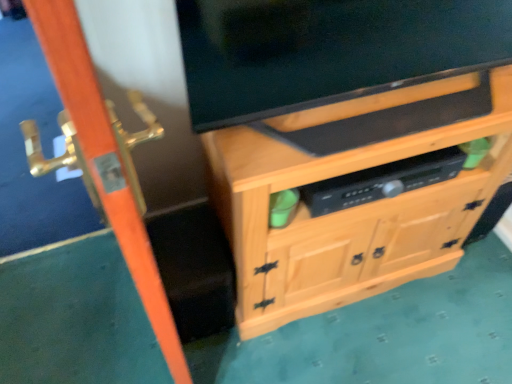
Question: From the image's perspective, is black plastic speaker at center located above matte black tv at upper center?

Choices:
 (A) yes
 (B) no

Answer: (B)

Question: From a real-world perspective, is black plastic speaker at center under matte black tv at upper center?

Choices:
 (A) yes
 (B) no

Answer: (A)

Question: Can we say black plastic speaker at center lies outside matte black tv at upper center?

Choices:
 (A) no
 (B) yes

Answer: (B)

Question: Can you confirm if black plastic speaker at center is positioned to the left of matte black tv at upper center?

Choices:
 (A) no
 (B) yes

Answer: (A)

Question: Could you tell me if black plastic speaker at center is turned towards matte black tv at upper center?

Choices:
 (A) yes
 (B) no

Answer: (B)

Question: Are black plastic speaker at center and matte black tv at upper center located far from each other?

Choices:
 (A) yes
 (B) no

Answer: (B)

Question: Is orange wood screen door at left next to black plastic speaker at center?

Choices:
 (A) yes
 (B) no

Answer: (B)

Question: Can you confirm if orange wood screen door at left is positioned to the right of black plastic speaker at center?

Choices:
 (A) yes
 (B) no

Answer: (B)

Question: Does orange wood screen door at left have a greater width compared to black plastic speaker at center?

Choices:
 (A) yes
 (B) no

Answer: (B)

Question: From the image's perspective, does orange wood screen door at left appear higher than black plastic speaker at center?

Choices:
 (A) yes
 (B) no

Answer: (B)

Question: Does orange wood screen door at left have a smaller size compared to black plastic speaker at center?

Choices:
 (A) yes
 (B) no

Answer: (B)

Question: From a real-world perspective, is orange wood screen door at left positioned under black plastic speaker at center based on gravity?

Choices:
 (A) yes
 (B) no

Answer: (B)

Question: Could you tell me if matte black tv at upper center is turned towards orange wood screen door at left?

Choices:
 (A) no
 (B) yes

Answer: (A)